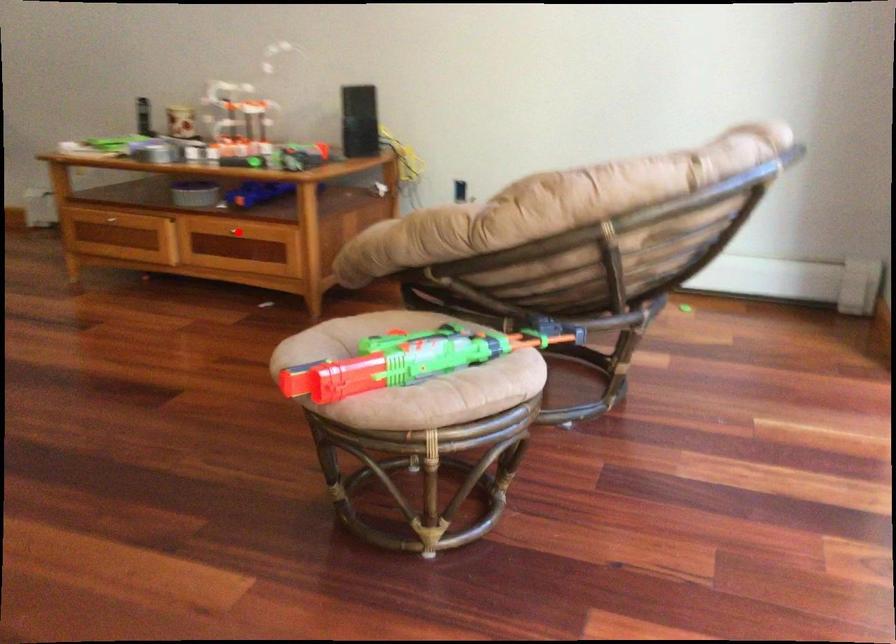
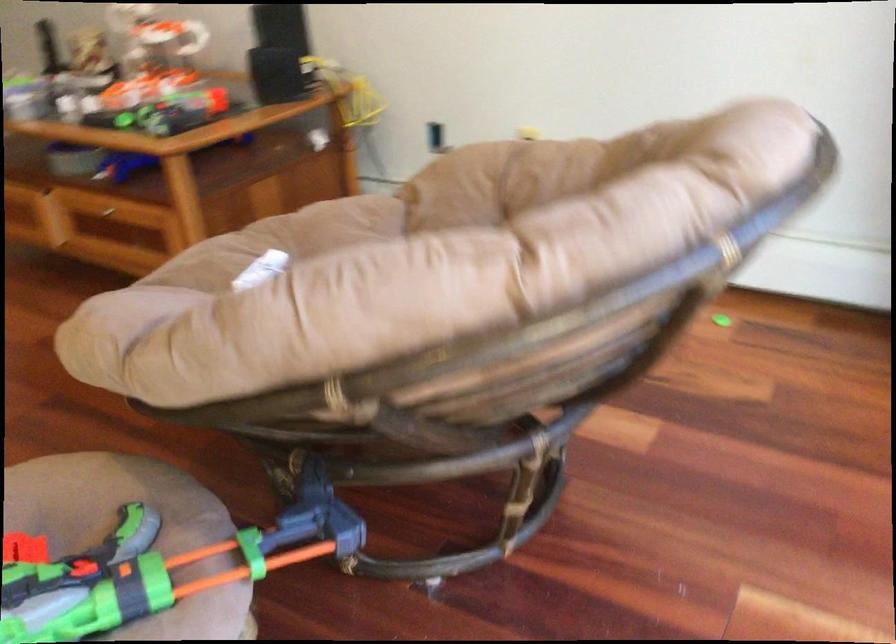
Find the pixel in the second image that matches the highlighted location in the first image.

(107, 213)